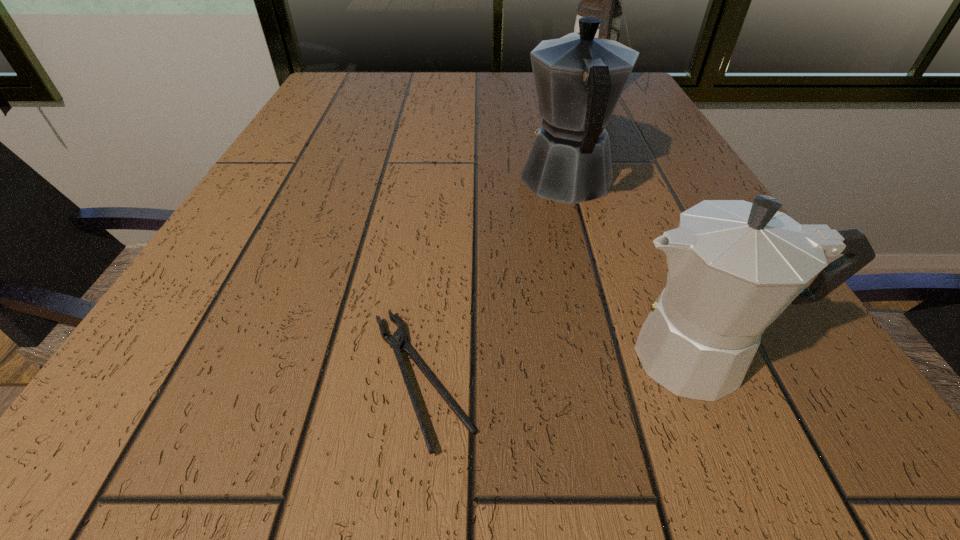
You are a GUI agent. You are given a task and a screenshot of the screen. Output one action in this format:
    pyautogui.click(x=<x>, y=<y>)
    Task: Click on the object located at the far right corner
    This screenshot has height=540, width=960.
    Given the screenshot: What is the action you would take?
    pyautogui.click(x=601, y=0)

Locate an element on the screen. object situated at the near right corner is located at coordinates (733, 266).

This screenshot has height=540, width=960. Identify the location of free space at the near edge. (546, 411).

Where is `vacant space at the left edge of the desktop`? vacant space at the left edge of the desktop is located at coordinates (296, 174).

This screenshot has width=960, height=540. I want to click on vacant space at the right edge, so click(x=620, y=130).

The width and height of the screenshot is (960, 540). Identify the location of vacant space at the far left corner of the desktop. (375, 79).

Identify the location of blank space at the near right corner of the desktop. This screenshot has height=540, width=960. (833, 450).

The height and width of the screenshot is (540, 960). Find the location of `free space that is in between the leftmost object and the shorter coffeepot`. free space that is in between the leftmost object and the shorter coffeepot is located at coordinates (563, 367).

At what (x,y) coordinates should I click in order to perform the action: click on vacant region between the second shortest object and the second farthest object. Please return your answer as a coordinate pair (x, y). Looking at the image, I should click on (636, 269).

At what (x,y) coordinates should I click in order to perform the action: click on free space between the nearer coffeepot and the farther coffeepot. Please return your answer as a coordinate pair (x, y). The height and width of the screenshot is (540, 960). Looking at the image, I should click on (636, 269).